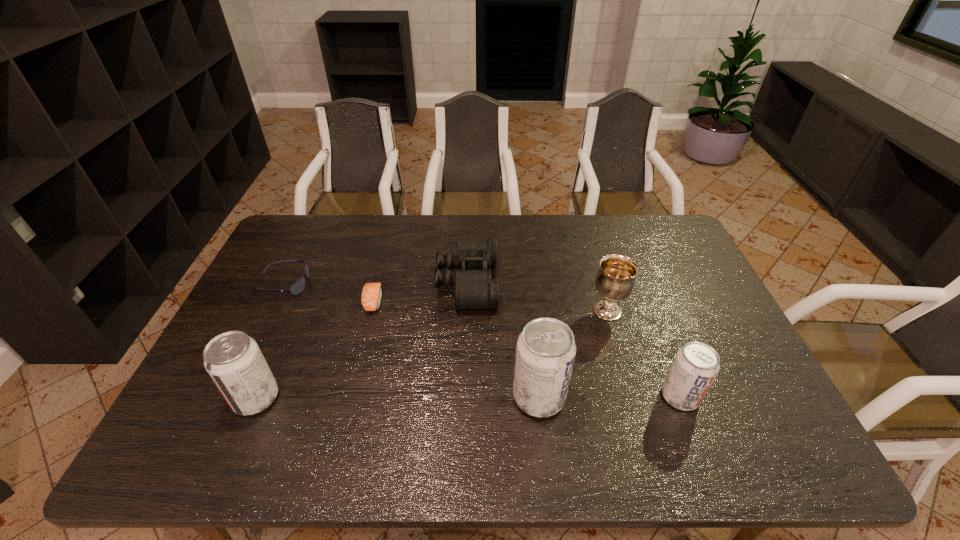
Where is `unoccupied position between the sunglasses and the second object from right to left`? The width and height of the screenshot is (960, 540). unoccupied position between the sunglasses and the second object from right to left is located at coordinates (444, 298).

I want to click on empty location between the sunglasses and the sixth object from left to right, so point(444,298).

This screenshot has height=540, width=960. Identify the location of vacant space in between the second soda can from right to left and the rightmost object. (610, 396).

Locate an element on the screen. the fourth closest object relative to the second shortest soda can is located at coordinates (545, 351).

Point out which object is positioned as the fourth nearest to the leftmost soda can. Please provide its 2D coordinates. Your answer should be formatted as a tuple, i.e. [(x, y)], where the tuple contains the x and y coordinates of a point satisfying the conditions above.

[(545, 351)]

The width and height of the screenshot is (960, 540). In order to click on soda can that is the second nearest to the binoculars in this screenshot , I will do `click(234, 361)`.

Point out which soda can is positioned as the nearest to the sunglasses. Please provide its 2D coordinates. Your answer should be formatted as a tuple, i.e. [(x, y)], where the tuple contains the x and y coordinates of a point satisfying the conditions above.

[(234, 361)]

What are the coordinates of `vacant area that satisfies the following two spatial constraints: 1. on the lenses of the fifth object from right to left; 2. on the left side of the sunglasses` in the screenshot? It's located at pos(275,301).

The height and width of the screenshot is (540, 960). I want to click on free space that satisfies the following two spatial constraints: 1. on the back side of the chalice; 2. on the lenses of the sunglasses, so click(x=599, y=284).

You are a GUI agent. You are given a task and a screenshot of the screen. Output one action in this format:
    pyautogui.click(x=<x>, y=<y>)
    Task: Click on the vacant region that satisfies the following two spatial constraints: 1. on the back side of the second tallest soda can; 2. on the right side of the second object from right to left
    
    Given the screenshot: What is the action you would take?
    pyautogui.click(x=293, y=311)